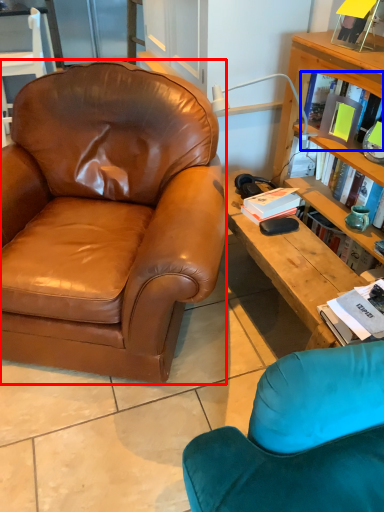
Question: Which point is further to the camera, chair (highlighted by a red box) or book (highlighted by a blue box)?

Choices:
 (A) chair
 (B) book

Answer: (B)